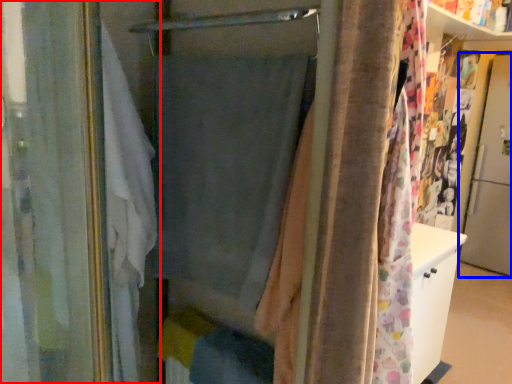
Question: Which object appears farthest to the camera in this image, curtain (highlighted by a red box) or screen door (highlighted by a blue box)?

Choices:
 (A) curtain
 (B) screen door

Answer: (B)